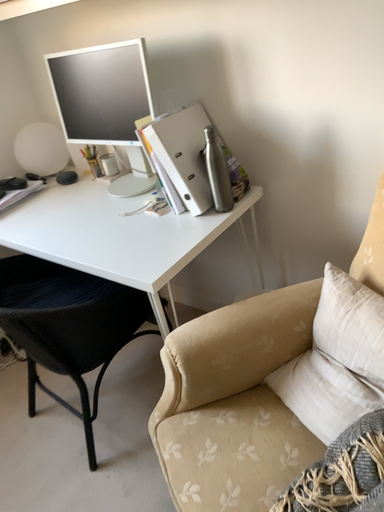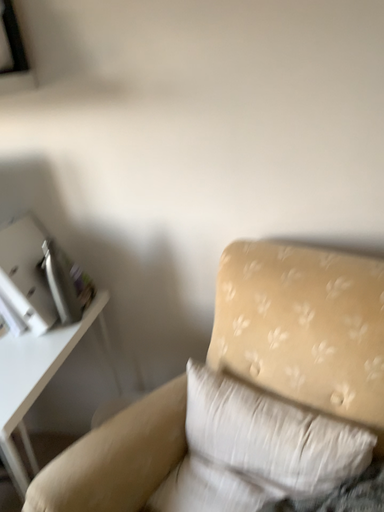
Question: Which way did the camera rotate in the video?

Choices:
 (A) rotated right
 (B) rotated left

Answer: (A)